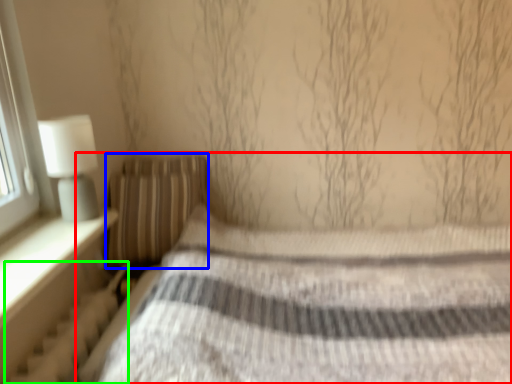
Question: Considering the real-world distances, which object is closest to bed (highlighted by a red box)? pillow (highlighted by a blue box) or radiator (highlighted by a green box).

Choices:
 (A) pillow
 (B) radiator

Answer: (A)